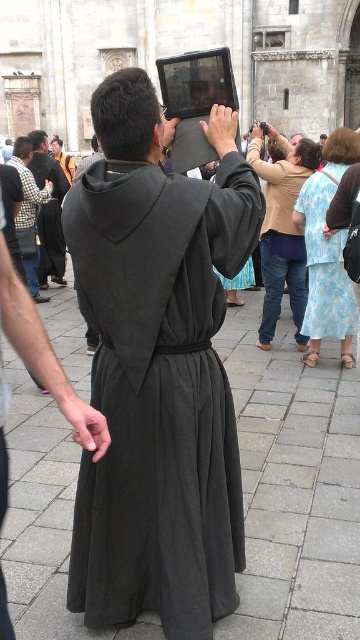
You are standing in front of a historic stone building and notice two items in the scene. The first is the matte black robe at center, and the second is the light brown fabric blouse at upper center. Which of these two items is taller?

The matte black robe at center is taller than the light brown fabric blouse at upper center.

You are standing at the camera position and want to take a photo of the matte black robe at center. Considering the distance, will you need a zoom lens to capture the robe clearly in your shot?

The matte black robe at center is 32.52 meters away from the camera. A zoom lens would be necessary to capture the robe clearly at that distance.